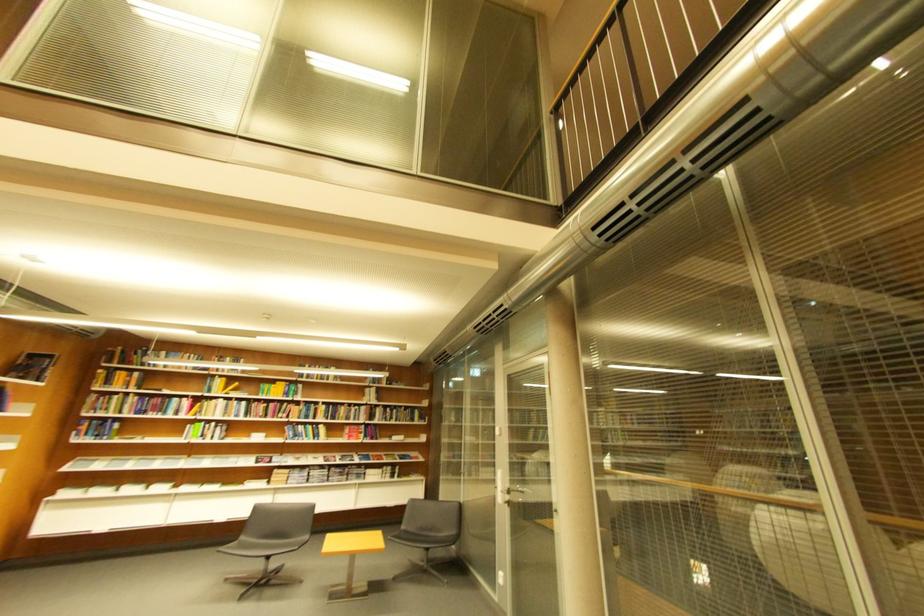
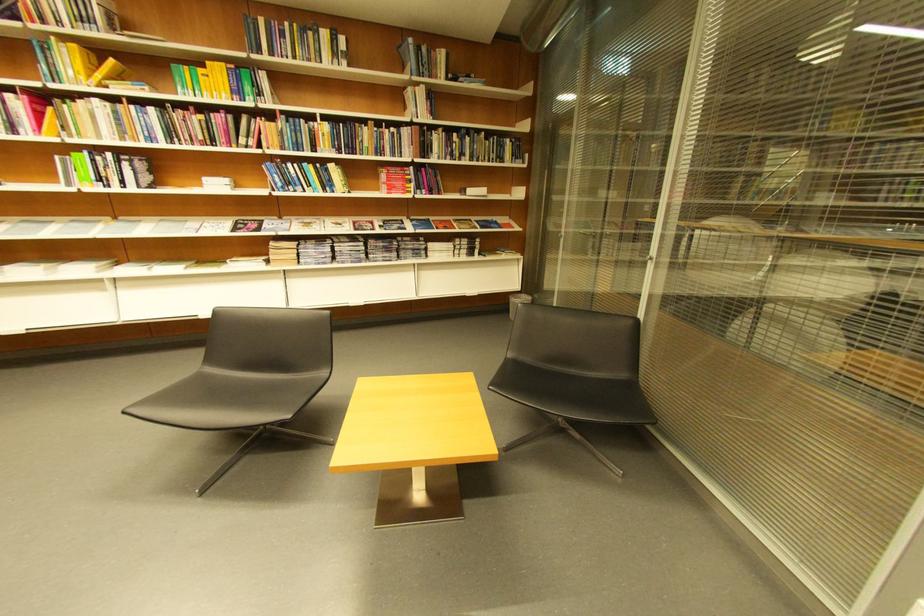
Where in the second image is the point corresponding to [379,391] from the first image?

(419, 91)